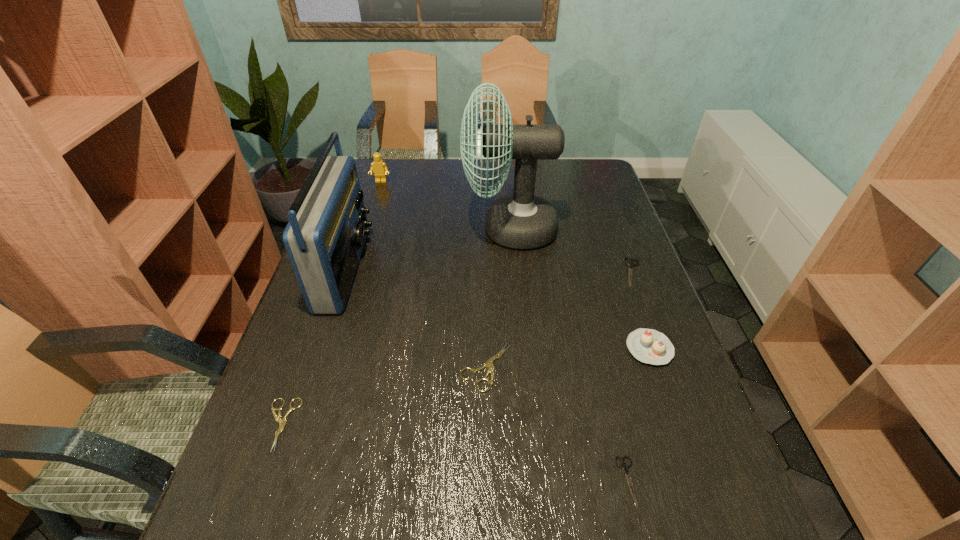
Identify the location of free spot located 0.060m on the back of the farther black shears. (623, 245).

I want to click on vacant space located on the left of the bigger beige shears, so click(373, 367).

At what (x,y) coordinates should I click in order to perform the action: click on vacant space located 0.180m on the right of the left beige shears. Please return your answer as a coordinate pair (x, y). The image size is (960, 540). Looking at the image, I should click on (383, 424).

Where is `blank space located 0.190m on the left of the sixth object from left to right`? This screenshot has height=540, width=960. blank space located 0.190m on the left of the sixth object from left to right is located at coordinates (517, 480).

You are a GUI agent. You are given a task and a screenshot of the screen. Output one action in this format:
    pyautogui.click(x=<x>, y=<y>)
    Task: Click on the object at the far edge
    The height and width of the screenshot is (540, 960).
    Given the screenshot: What is the action you would take?
    pyautogui.click(x=378, y=166)

Locate an element on the screen. This screenshot has width=960, height=540. radio receiver at the left edge is located at coordinates (324, 238).

Locate an element on the screen. This screenshot has width=960, height=540. Lego that is at the left edge is located at coordinates (378, 166).

This screenshot has height=540, width=960. Find the location of `shears that is at the left edge`. shears that is at the left edge is located at coordinates (282, 421).

I want to click on cupcake that is at the right edge, so click(649, 346).

The height and width of the screenshot is (540, 960). Identify the location of shears that is at the right edge. (630, 264).